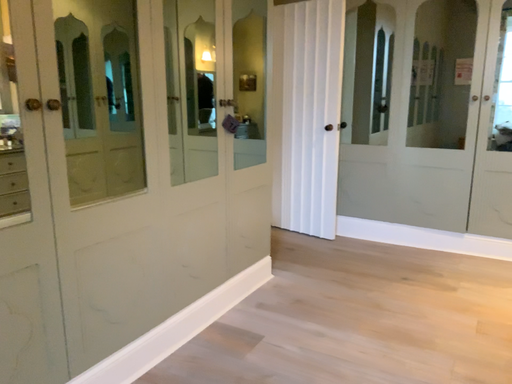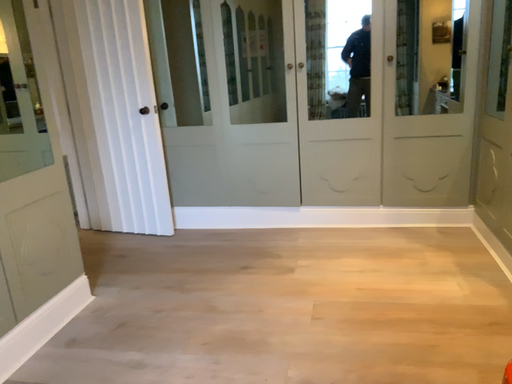
Question: Which way did the camera rotate in the video?

Choices:
 (A) rotated right
 (B) rotated left

Answer: (A)